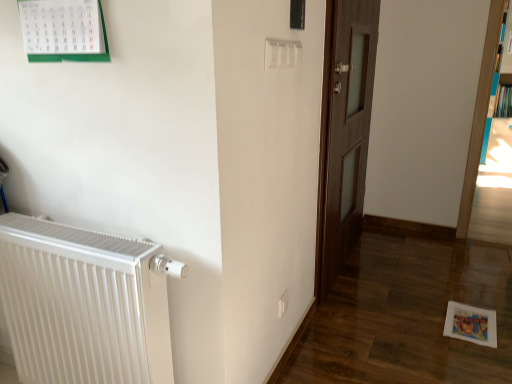
Image resolution: width=512 pixels, height=384 pixels. What do you see at coordinates (495, 81) in the screenshot?
I see `blue glossy bookcase at right, which is the 1th bookcase in right-to-left order` at bounding box center [495, 81].

The image size is (512, 384). What do you see at coordinates (82, 305) in the screenshot?
I see `white metallic radiator at left` at bounding box center [82, 305].

This screenshot has width=512, height=384. What do you see at coordinates (344, 132) in the screenshot? I see `dark wood door at center` at bounding box center [344, 132].

The height and width of the screenshot is (384, 512). I want to click on wooden bookshelf at right, which is counted as the 2th bookcase, starting from the back, so click(x=482, y=109).

Locate an element on the screen. hardcover book at upper right is located at coordinates (503, 102).

Which is in front, blue glossy bookcase at right, marked as the 1th bookcase in a back-to-front arrangement, or wooden bookshelf at right, which is counted as the 2th bookcase, starting from the back?

Positioned in front is wooden bookshelf at right, which is counted as the 2th bookcase, starting from the back.

How different are the orientations of blue glossy bookcase at right, the 2th bookcase viewed from the left, and wooden bookshelf at right, which is counted as the 1th bookcase, starting from the left, in degrees?

There is a 1.9-degree angle between the facing directions of blue glossy bookcase at right, the 2th bookcase viewed from the left, and wooden bookshelf at right, which is counted as the 1th bookcase, starting from the left.

Are blue glossy bookcase at right, the 2th bookcase viewed from the left, and wooden bookshelf at right, arranged as the 1th bookcase when viewed from the front, making contact?

There is a gap between blue glossy bookcase at right, the 2th bookcase viewed from the left, and wooden bookshelf at right, arranged as the 1th bookcase when viewed from the front.

The image size is (512, 384). Identify the location of bookcase below the blue glossy bookcase at right, the 2th bookcase viewed from the left (from a real-world perspective). (482, 109).

From the image's perspective, between white plastic electric outlet at lower center and white metallic radiator at left, who is located below?

white plastic electric outlet at lower center, from the image's perspective.

Is point (279, 301) more distant than point (136, 316)?

Yes.

Does white plastic electric outlet at lower center appear on the right side of white metallic radiator at left?

Correct, you'll find white plastic electric outlet at lower center to the right of white metallic radiator at left.

From a real-world perspective, is white plastic electric outlet at lower center over white metallic radiator at left?

No, from a real-world perspective, white plastic electric outlet at lower center is not above white metallic radiator at left.

Where is `electric outlet located in front of the hardcover book at upper right`? electric outlet located in front of the hardcover book at upper right is located at coordinates (283, 304).

Is hardcover book at upper right to the left of white plastic electric outlet at lower center from the viewer's perspective?

No, hardcover book at upper right is not to the left of white plastic electric outlet at lower center.

From the image's perspective, which one is positioned lower, hardcover book at upper right or white plastic electric outlet at lower center?

white plastic electric outlet at lower center appears lower in the image.

Is point (505, 93) closer to camera compared to point (280, 300)?

No, (505, 93) is behind (280, 300).

Considering the positions of points (490, 111) and (495, 112), is point (490, 111) closer to camera compared to point (495, 112)?

Yes.

Identify the location of book directly beneath the blue glossy bookcase at right, marked as the 1th bookcase in a back-to-front arrangement (from a real-world perspective). This screenshot has height=384, width=512. (503, 102).

Between blue glossy bookcase at right, the 2th bookcase viewed from the left, and hardcover book at upper right, which one has smaller width?

Thinner between the two is hardcover book at upper right.

Considering the relative sizes of blue glossy bookcase at right, the second bookcase when ordered from front to back, and hardcover book at upper right in the image provided, is blue glossy bookcase at right, the second bookcase when ordered from front to back, taller than hardcover book at upper right?

Indeed, blue glossy bookcase at right, the second bookcase when ordered from front to back, has a greater height compared to hardcover book at upper right.

From the image's perspective, would you say white plastic electric outlet at lower center is shown under wooden bookshelf at right, which is counted as the 2th bookcase, starting from the back?

Answer: Correct, white plastic electric outlet at lower center appears lower than wooden bookshelf at right, which is counted as the 2th bookcase, starting from the back, in the image.

Considering the relative positions of white plastic electric outlet at lower center and wooden bookshelf at right, which is counted as the 1th bookcase, starting from the left, in the image provided, is white plastic electric outlet at lower center to the right of wooden bookshelf at right, which is counted as the 1th bookcase, starting from the left, from the viewer's perspective?

No, white plastic electric outlet at lower center is not to the right of wooden bookshelf at right, which is counted as the 1th bookcase, starting from the left.

Based on the photo, considering the relative sizes of white plastic electric outlet at lower center and wooden bookshelf at right, arranged as the 1th bookcase when viewed from the front, in the image provided, is white plastic electric outlet at lower center taller than wooden bookshelf at right, arranged as the 1th bookcase when viewed from the front,?

In fact, white plastic electric outlet at lower center may be shorter than wooden bookshelf at right, arranged as the 1th bookcase when viewed from the front.

Considering the relative sizes of white plastic electric outlet at lower center and wooden bookshelf at right, arranged as the 1th bookcase when viewed from the front, in the image provided, is white plastic electric outlet at lower center wider than wooden bookshelf at right, arranged as the 1th bookcase when viewed from the front,?

No.

Can we say hardcover book at upper right lies outside wooden bookshelf at right, which is counted as the 2th bookcase, starting from the back?

hardcover book at upper right lies outside wooden bookshelf at right, which is counted as the 2th bookcase, starting from the back,'s area.

Which object is closer to the camera, hardcover book at upper right or wooden bookshelf at right, which is counted as the 2th bookcase, starting from the back?

wooden bookshelf at right, which is counted as the 2th bookcase, starting from the back.

Between hardcover book at upper right and wooden bookshelf at right, which is counted as the 1th bookcase, starting from the left, which one appears on the right side from the viewer's perspective?

hardcover book at upper right is more to the right.

Looking at this image, is hardcover book at upper right not near wooden bookshelf at right, which is counted as the 2th bookcase, starting from the back?

Yes.

Are white metallic radiator at left and white plastic electric outlet at lower center located far from each other?

Actually, white metallic radiator at left and white plastic electric outlet at lower center are a little close together.

From a real-world perspective, is white metallic radiator at left positioned under white plastic electric outlet at lower center based on gravity?

Actually, white metallic radiator at left is physically above white plastic electric outlet at lower center in the real world.

Considering the sizes of objects white metallic radiator at left and white plastic electric outlet at lower center in the image provided, who is wider, white metallic radiator at left or white plastic electric outlet at lower center?

white metallic radiator at left.

Considering the sizes of objects white metallic radiator at left and white plastic electric outlet at lower center in the image provided, who is smaller, white metallic radiator at left or white plastic electric outlet at lower center?

With smaller size is white plastic electric outlet at lower center.

Where is `bookcase located underneath the blue glossy bookcase at right, marked as the 1th bookcase in a back-to-front arrangement (from a real-world perspective)`? The height and width of the screenshot is (384, 512). bookcase located underneath the blue glossy bookcase at right, marked as the 1th bookcase in a back-to-front arrangement (from a real-world perspective) is located at coordinates (482, 109).

Image resolution: width=512 pixels, height=384 pixels. Identify the location of electric outlet behind the white metallic radiator at left. (283, 304).

Considering their positions, is dark wood door at center positioned closer to wooden bookshelf at right, the second bookcase in the right-to-left sequence, than hardcover book at upper right?

dark wood door at center lies closer to wooden bookshelf at right, the second bookcase in the right-to-left sequence, than the other object.

Which object lies further to the anchor point dark wood door at center, white plastic electric outlet at lower center or blue glossy bookcase at right, which is the 1th bookcase in right-to-left order?

Among the two, blue glossy bookcase at right, which is the 1th bookcase in right-to-left order, is located further to dark wood door at center.

From the image, which object appears to be nearer to wooden bookshelf at right, arranged as the 1th bookcase when viewed from the front, hardcover book at upper right or white plastic electric outlet at lower center?

Among the two, white plastic electric outlet at lower center is located nearer to wooden bookshelf at right, arranged as the 1th bookcase when viewed from the front.

When comparing their distances from wooden bookshelf at right, arranged as the 1th bookcase when viewed from the front, does white plastic electric outlet at lower center or dark wood door at center seem further?

white plastic electric outlet at lower center is further to wooden bookshelf at right, arranged as the 1th bookcase when viewed from the front.

Looking at the image, which one is located further to white plastic electric outlet at lower center, dark wood door at center or white metallic radiator at left?

Based on the image, dark wood door at center appears to be further to white plastic electric outlet at lower center.

Looking at the image, which one is located closer to dark wood door at center, blue glossy bookcase at right, the second bookcase when ordered from front to back, or white plastic electric outlet at lower center?

white plastic electric outlet at lower center is positioned closer to the anchor dark wood door at center.

Consider the image. Estimate the real-world distances between objects in this image. Which object is further from white plastic electric outlet at lower center, white metallic radiator at left or hardcover book at upper right?

hardcover book at upper right is further to white plastic electric outlet at lower center.

Which object lies further to the anchor point hardcover book at upper right, blue glossy bookcase at right, marked as the 1th bookcase in a back-to-front arrangement, or wooden bookshelf at right, arranged as the 1th bookcase when viewed from the front?

wooden bookshelf at right, arranged as the 1th bookcase when viewed from the front, is further to hardcover book at upper right.

Locate an element on the screen. bookcase between white metallic radiator at left and blue glossy bookcase at right, which is the 1th bookcase in right-to-left order, in the horizontal direction is located at coordinates (482, 109).

Locate an element on the screen. The width and height of the screenshot is (512, 384). door located between white plastic electric outlet at lower center and wooden bookshelf at right, the second bookcase in the right-to-left sequence, in the left-right direction is located at coordinates (x=344, y=132).

This screenshot has height=384, width=512. I want to click on door located between white plastic electric outlet at lower center and hardcover book at upper right in the depth direction, so click(344, 132).

Find the location of a particular element. Image resolution: width=512 pixels, height=384 pixels. bookcase between wooden bookshelf at right, which is counted as the 2th bookcase, starting from the back, and hardcover book at upper right, along the z-axis is located at coordinates coord(495,81).